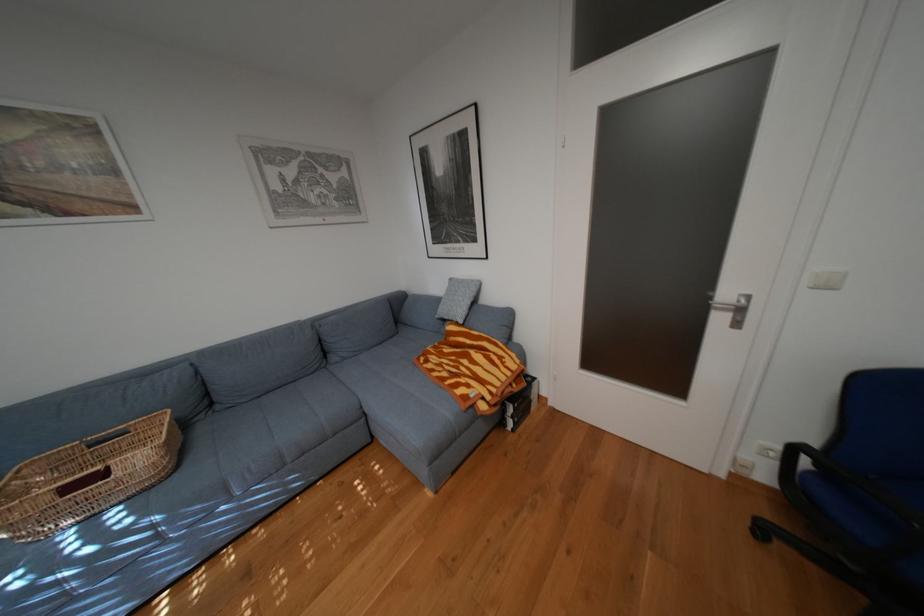
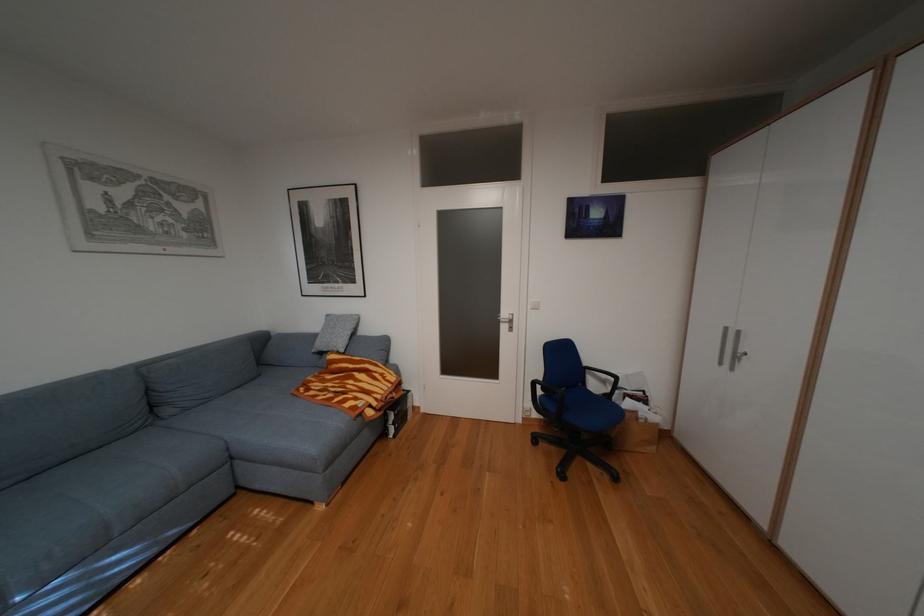
Question: The camera is either moving clockwise (left) or counter-clockwise (right) around the object. The first image is from the beginning of the video and the second image is from the end. Is the camera moving left or right when shooting the video?

Choices:
 (A) Left
 (B) Right

Answer: (A)